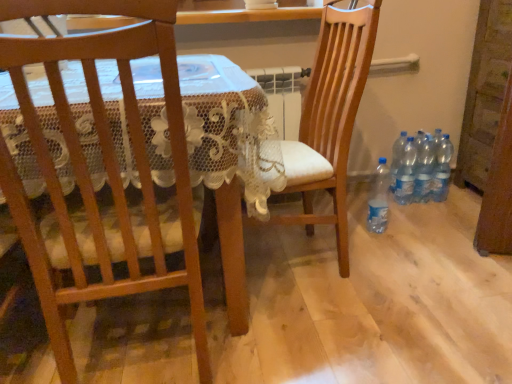
At what (x,y) coordinates should I click in order to perform the action: click on space that is in front of clear plastic bottles at lower right, acting as the 2th bottle starting from the right. Please return your answer as a coordinate pair (x, y). The image size is (512, 384). Looking at the image, I should click on (430, 215).